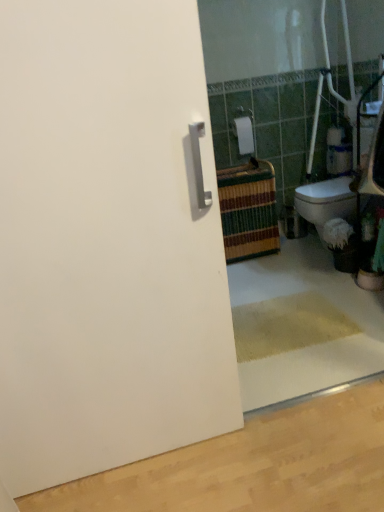
Question: Would you say white matte door at left is a long distance from white matte toilet paper at upper center?

Choices:
 (A) yes
 (B) no

Answer: (A)

Question: Considering the relative sizes of white matte door at left and white matte toilet paper at upper center in the image provided, is white matte door at left thinner than white matte toilet paper at upper center?

Choices:
 (A) no
 (B) yes

Answer: (B)

Question: Considering the relative positions of white matte door at left and white matte toilet paper at upper center in the image provided, is white matte door at left to the right of white matte toilet paper at upper center from the viewer's perspective?

Choices:
 (A) no
 (B) yes

Answer: (A)

Question: Is white matte door at left positioned with its back to white matte toilet paper at upper center?

Choices:
 (A) yes
 (B) no

Answer: (B)

Question: Is white matte door at left positioned beyond the bounds of white matte toilet paper at upper center?

Choices:
 (A) yes
 (B) no

Answer: (A)

Question: From a real-world perspective, is white matte door at left below white matte toilet paper at upper center?

Choices:
 (A) yes
 (B) no

Answer: (A)

Question: Is white matte toilet paper at upper center positioned before white matte door at left?

Choices:
 (A) yes
 (B) no

Answer: (B)

Question: From the image's perspective, is white matte toilet paper at upper center below white matte door at left?

Choices:
 (A) yes
 (B) no

Answer: (B)

Question: Considering the relative positions of white matte toilet paper at upper center and white matte door at left in the image provided, is white matte toilet paper at upper center behind white matte door at left?

Choices:
 (A) yes
 (B) no

Answer: (A)

Question: Is white matte door at left completely or partially inside white matte toilet paper at upper center?

Choices:
 (A) yes
 (B) no

Answer: (B)

Question: Is white matte toilet paper at upper center completely or partially outside of white matte door at left?

Choices:
 (A) no
 (B) yes

Answer: (B)

Question: Is white matte toilet paper at upper center looking in the opposite direction of white matte door at left?

Choices:
 (A) no
 (B) yes

Answer: (A)

Question: From the image's perspective, is white matte toilet paper at upper center positioned above or below white matte door at left?

Choices:
 (A) above
 (B) below

Answer: (A)